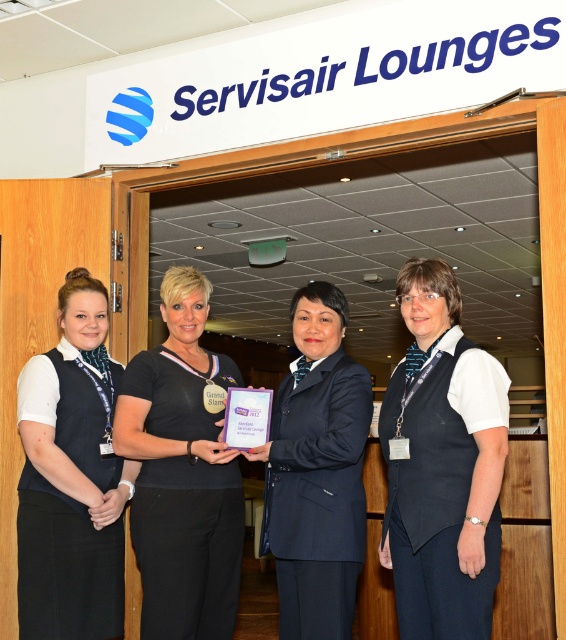
Question: Which point appears closest to the camera in this image?

Choices:
 (A) (158, 412)
 (B) (398, 298)
 (C) (89, 451)

Answer: (B)

Question: Which point is farther to the camera?

Choices:
 (A) click(x=397, y=468)
 (B) click(x=87, y=545)

Answer: (B)

Question: Which of the following is the closest to the observer?

Choices:
 (A) (75, 529)
 (B) (190, 429)
 (C) (427, 589)

Answer: (C)

Question: Can you confirm if white fabric vest at center is wider than black fabric shirt at center?

Choices:
 (A) no
 (B) yes

Answer: (A)

Question: Is black fabric shirt at center above matte black vest at left?

Choices:
 (A) no
 (B) yes

Answer: (A)

Question: Does white fabric vest at center have a greater width compared to black fabric shirt at center?

Choices:
 (A) no
 (B) yes

Answer: (A)